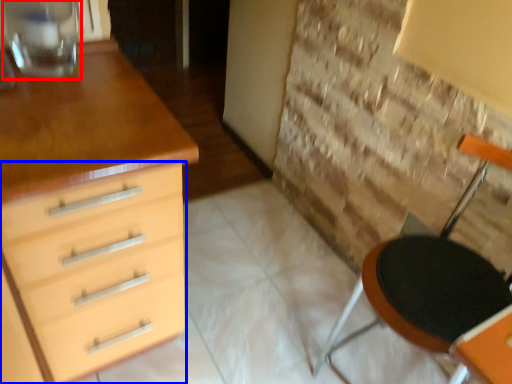
Question: Which object appears farthest to the camera in this image, glass vase (highlighted by a red box) or chest of drawers (highlighted by a blue box)?

Choices:
 (A) glass vase
 (B) chest of drawers

Answer: (A)